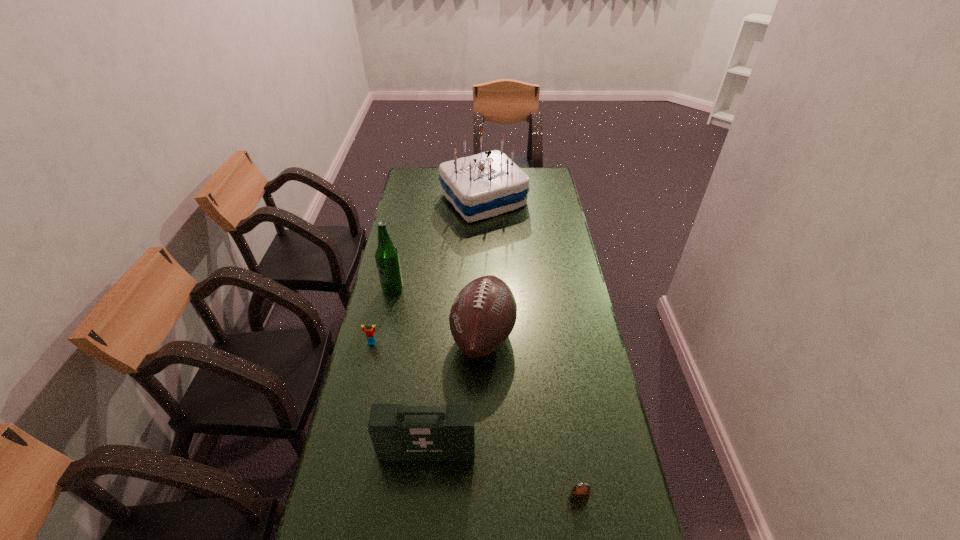
Where is `blank area at the far left corner`? This screenshot has height=540, width=960. blank area at the far left corner is located at coordinates point(411,182).

The width and height of the screenshot is (960, 540). In the image, there is a desktop. What are the coordinates of `free region at the far right corner` in the screenshot? It's located at (541, 173).

At what (x,y) coordinates should I click in order to perform the action: click on free spot between the football (American) and the Lego. Please return your answer as a coordinate pair (x, y). This screenshot has width=960, height=540. Looking at the image, I should click on (427, 339).

Image resolution: width=960 pixels, height=540 pixels. What are the coordinates of `vacant space that is in between the padlock and the farthest object` in the screenshot? It's located at (531, 349).

Where is `free spot between the football (American) and the padlock`? free spot between the football (American) and the padlock is located at coordinates (531, 417).

The height and width of the screenshot is (540, 960). In order to click on free space between the nearest object and the birthday cake in this screenshot , I will do `click(531, 349)`.

The height and width of the screenshot is (540, 960). What are the coordinates of `vacant point located between the football (American) and the Lego` in the screenshot? It's located at (427, 339).

Find the location of `vacant region between the football (American) and the nearest object`. vacant region between the football (American) and the nearest object is located at coordinates (531, 417).

This screenshot has height=540, width=960. I want to click on unoccupied area between the fifth farthest object and the football (American), so click(x=455, y=393).

Find the location of a particular element. free space between the nearest object and the farthest object is located at coordinates pos(531,349).